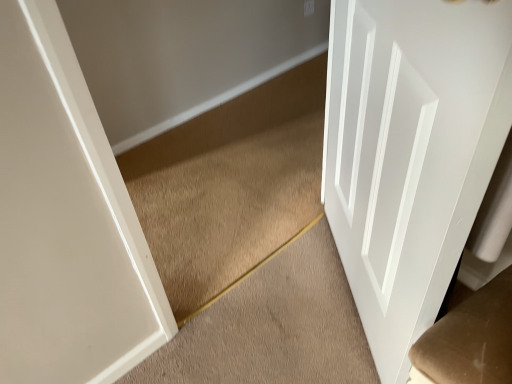
Question: Is carpet at center situated inside white glossy door at right or outside?

Choices:
 (A) inside
 (B) outside

Answer: (B)

Question: In terms of size, does carpet at center appear bigger or smaller than white glossy door at right?

Choices:
 (A) small
 (B) big

Answer: (A)

Question: Is carpet at center to the left or to the right of white glossy door at right in the image?

Choices:
 (A) right
 (B) left

Answer: (B)

Question: Considering the positions of white glossy door at right and carpet at center in the image, is white glossy door at right taller or shorter than carpet at center?

Choices:
 (A) tall
 (B) short

Answer: (A)

Question: Based on their sizes in the image, would you say white glossy door at right is bigger or smaller than carpet at center?

Choices:
 (A) big
 (B) small

Answer: (A)

Question: Is white glossy door at right in front of or behind carpet at center in the image?

Choices:
 (A) front
 (B) behind

Answer: (A)

Question: From the image's perspective, is white glossy door at right positioned above or below carpet at center?

Choices:
 (A) above
 (B) below

Answer: (A)